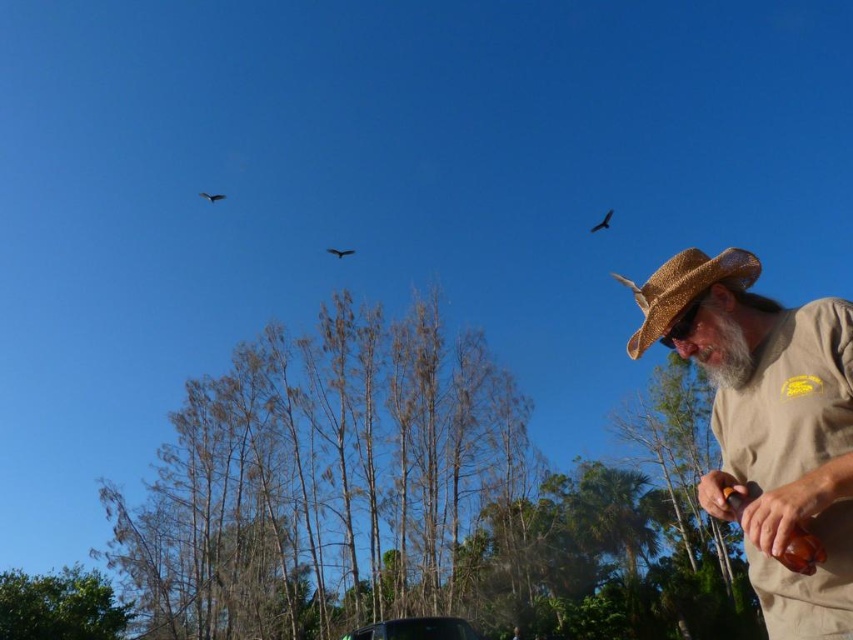
You are standing in the outdoor scene shown. You want to place a new tree sapling exactly at point (769, 422). However, there is already an object there. What object is blocking the placement of the sapling?

The tan straw hat at right is located at point (769, 422), so the object blocking the placement is the tan straw hat at right.